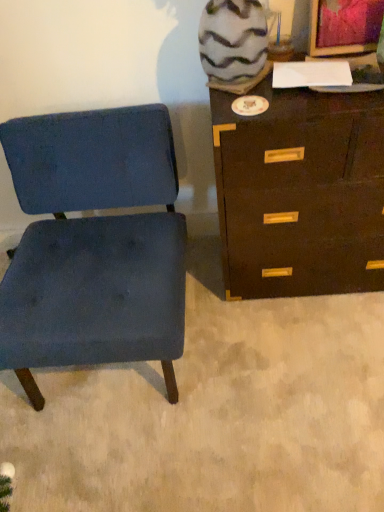
This screenshot has width=384, height=512. I want to click on vacant area that is situated to the right of blue fabric chair at left, so click(272, 351).